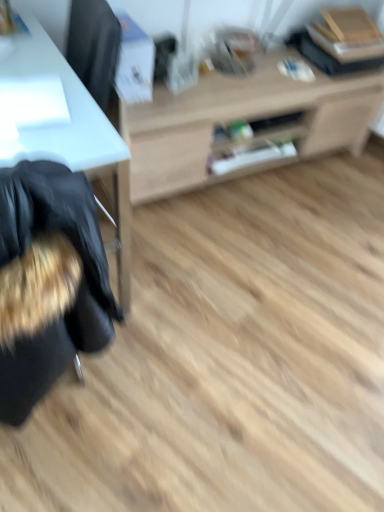
Locate an element on the screen. vacant area located to the right-hand side of light wood cabinet at center is located at coordinates (335, 198).